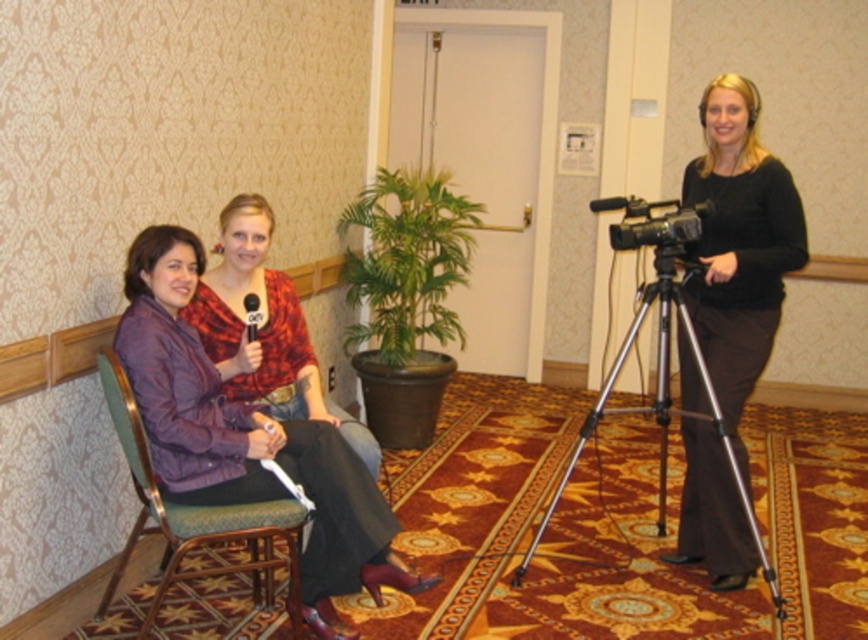
Question: Which point is farther from the camera taking this photo?

Choices:
 (A) (135, 449)
 (B) (612, 198)
 (C) (196, 305)
 (D) (778, 240)

Answer: (B)

Question: Which point is closer to the camera?

Choices:
 (A) silver metallic tripod at center
 (B) black plastic microphone at center
 (C) black plastic video camera at center

Answer: (B)

Question: Does purple fabric jacket at left have a larger size compared to silver metallic tripod at center?

Choices:
 (A) yes
 (B) no

Answer: (B)

Question: Is the position of black matte camera at right more distant than that of silver metallic tripod at center?

Choices:
 (A) no
 (B) yes

Answer: (B)

Question: Among these objects, which one is nearest to the camera?

Choices:
 (A) black plastic video camera at center
 (B) black matte camera at right
 (C) purple matte jacket at left

Answer: (C)

Question: Is silver metallic tripod at center thinner than black plastic video camera at center?

Choices:
 (A) no
 (B) yes

Answer: (A)